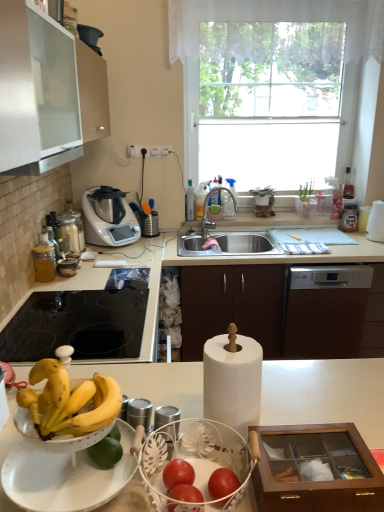
Question: Should I look upward or downward to see white plastic cup at right, which is counted as the second appliance, starting from the left?

Choices:
 (A) down
 (B) up

Answer: (B)

Question: Considering the relative positions of metallic silver blender at upper right, the first appliance viewed from the left, and black glass cooktop at lower left in the image provided, is metallic silver blender at upper right, the first appliance viewed from the left, in front of black glass cooktop at lower left?

Choices:
 (A) yes
 (B) no

Answer: (B)

Question: Is metallic silver blender at upper right, which is the first appliance in back-to-front order, further to camera compared to black glass cooktop at lower left?

Choices:
 (A) no
 (B) yes

Answer: (B)

Question: Is metallic silver blender at upper right, which is the first appliance in back-to-front order, shorter than black glass cooktop at lower left?

Choices:
 (A) yes
 (B) no

Answer: (A)

Question: Is metallic silver blender at upper right, which is the first appliance in back-to-front order, not inside black glass cooktop at lower left?

Choices:
 (A) yes
 (B) no

Answer: (A)

Question: Does metallic silver blender at upper right, which is the first appliance in back-to-front order, turn towards black glass cooktop at lower left?

Choices:
 (A) no
 (B) yes

Answer: (A)

Question: From the image's perspective, would you say metallic silver blender at upper right, the first appliance viewed from the left, is shown under black glass cooktop at lower left?

Choices:
 (A) yes
 (B) no

Answer: (B)

Question: From a real-world perspective, is matte silver faucet at sink center located higher than metallic silver food processor at center-left?

Choices:
 (A) no
 (B) yes

Answer: (A)

Question: From the image's perspective, would you say matte silver faucet at sink center is positioned over metallic silver food processor at center-left?

Choices:
 (A) no
 (B) yes

Answer: (B)

Question: Considering the relative sizes of matte silver faucet at sink center and metallic silver food processor at center-left in the image provided, is matte silver faucet at sink center wider than metallic silver food processor at center-left?

Choices:
 (A) yes
 (B) no

Answer: (B)

Question: Is matte silver faucet at sink center looking in the opposite direction of metallic silver food processor at center-left?

Choices:
 (A) no
 (B) yes

Answer: (A)

Question: Is matte silver faucet at sink center completely or partially outside of metallic silver food processor at center-left?

Choices:
 (A) no
 (B) yes

Answer: (B)

Question: Can you confirm if matte silver faucet at sink center is taller than metallic silver food processor at center-left?

Choices:
 (A) no
 (B) yes

Answer: (A)

Question: Are matte silver faucet at sink center and black glass cooktop at lower left beside each other?

Choices:
 (A) yes
 (B) no

Answer: (B)